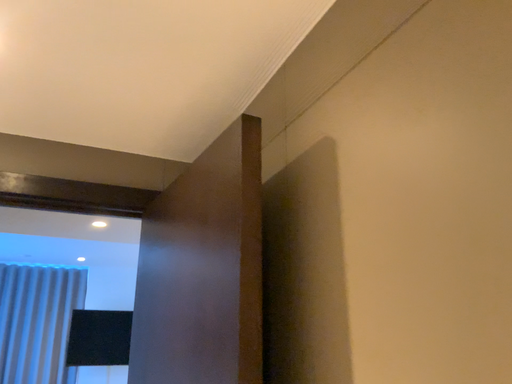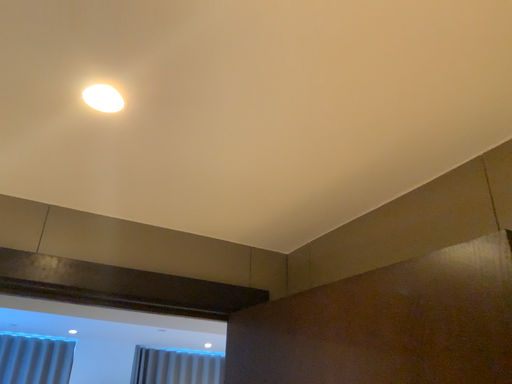
Question: Which way did the camera rotate in the video?

Choices:
 (A) rotated upward
 (B) rotated downward

Answer: (A)